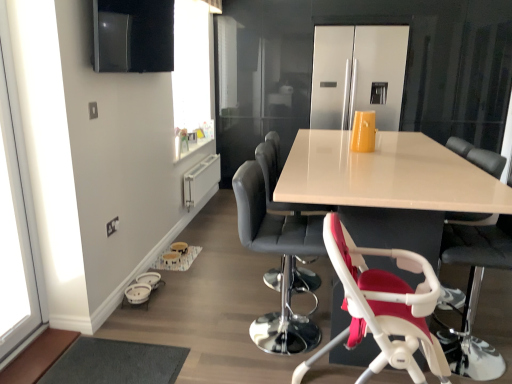
You are a GUI agent. You are given a task and a screenshot of the screen. Output one action in this format:
    pyautogui.click(x=<x>, y=<y>)
    Task: Click on the vacant area in front of black leather bar stool at center, marked as the 2th chair in a back-to-front arrangement
    
    Given the screenshot: What is the action you would take?
    pyautogui.click(x=280, y=368)